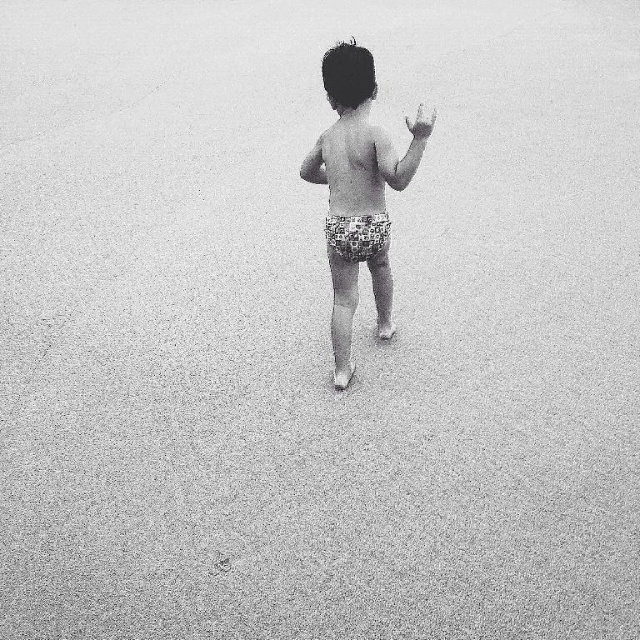
You are a photographer trying to capture a closeup shot of the printed fabric shorts at center and the smooth skin hand at upper right. Which object should you zoom in on to ensure both are in focus without moving the camera?

You should zoom in on the printed fabric shorts at center because it is larger in size compared to the smooth skin hand at upper right, allowing both to be in focus without moving the camera.

You are a photographer who wants to capture a closeup of the smooth skin hand at upper right without the smooth skin torso at center blocking it. Is this possible given their positions?

The smooth skin torso at center is further to the viewer than the smooth skin hand at upper right, so the torso is closer to the camera and would block the hand. Therefore, it is not possible to capture a closeup of the smooth skin hand at upper right without the torso blocking it.

You are a photographer trying to capture a candid shot of the child. You need to ensure that both the printed fabric shorts at center and the smooth skin hand at upper right are in focus. Given that your camera has a depth of field that can cover 28 inches, will both objects be in focus?

The printed fabric shorts at center and the smooth skin hand at upper right are 28.25 inches apart. Since the camera can cover 28 inches, the distance between them exceeds the depth of field capacity by 0.25 inches. Therefore, both objects might not be fully in focus.